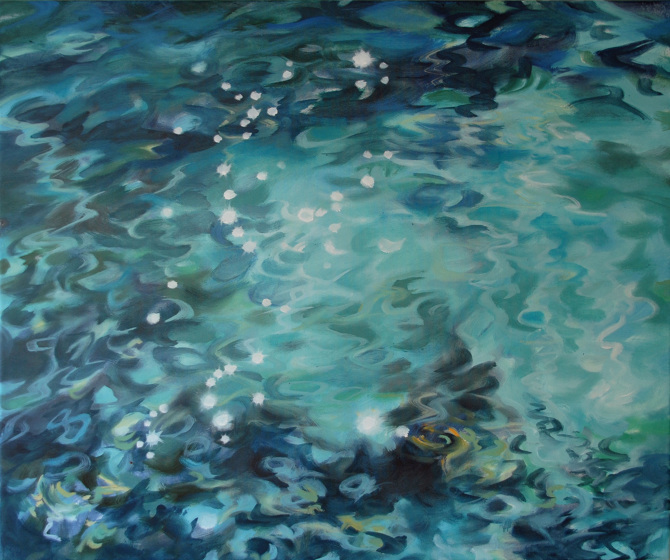
Image resolution: width=670 pixels, height=560 pixels. Find the location of `painting of water`. painting of water is located at coordinates (616, 224).